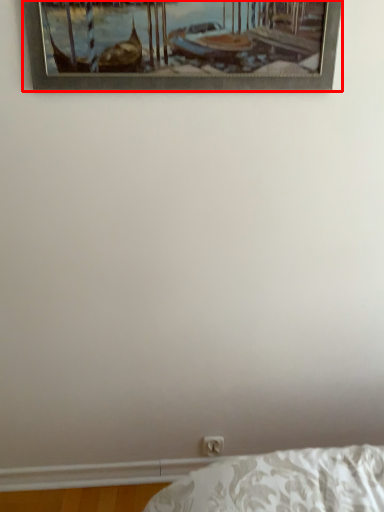
Question: From the image's perspective, where is picture frame (annotated by the red box) located relative to electric outlet?

Choices:
 (A) above
 (B) below

Answer: (A)